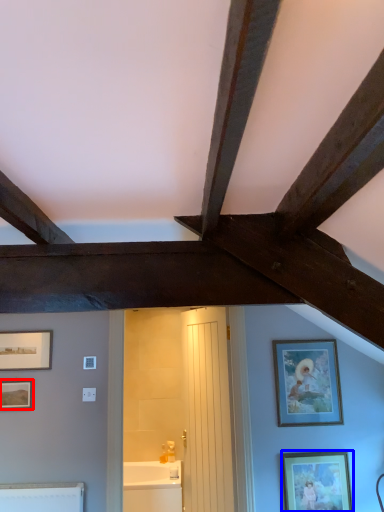
Question: Which object appears closest to the camera in this image, picture frame (highlighted by a red box) or picture frame (highlighted by a blue box)?

Choices:
 (A) picture frame
 (B) picture frame

Answer: (B)